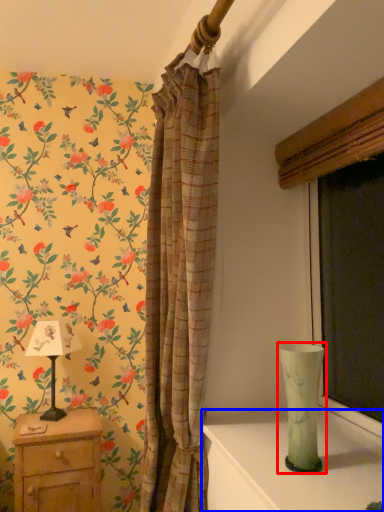
Question: Which of the following is the farthest to the observer, glass vase (highlighted by a red box) or table (highlighted by a blue box)?

Choices:
 (A) glass vase
 (B) table

Answer: (A)